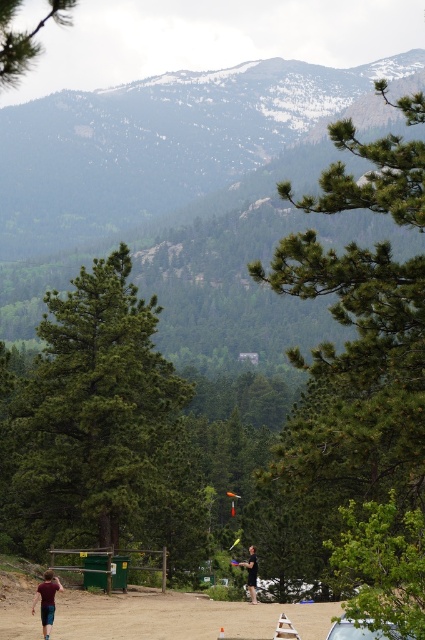
Describe the element at coordinates (99, 424) in the screenshot. This screenshot has width=425, height=640. I see `green rough bark tree at center` at that location.

Is the position of green rough bark tree at center more distant than that of metallic silver car at lower right?

Yes, green rough bark tree at center is behind metallic silver car at lower right.

Who is more forward, (68, 445) or (363, 632)?

Point (363, 632) is more forward.

I want to click on green rough bark tree at center, so click(99, 424).

Is green leafy tree at upper left bigger than maroon t-shirt at lower left?

Correct, green leafy tree at upper left is larger in size than maroon t-shirt at lower left.

Looking at this image, does green leafy tree at upper left appear under maroon t-shirt at lower left?

Actually, green leafy tree at upper left is above maroon t-shirt at lower left.

Between point (17, 1) and point (51, 611), which one is positioned in front?

Point (17, 1)

This screenshot has height=640, width=425. What are the coordinates of `green leafy tree at upper left` in the screenshot? It's located at (25, 38).

In the scene shown: Can you confirm if green leafy tree at upper left is positioned below black fabric shirt at lower center?

No.

Between green leafy tree at upper left and black fabric shirt at lower center, which one has more height?

Standing taller between the two is black fabric shirt at lower center.

Who is more forward, (48, 12) or (254, 573)?

Point (48, 12)

Find the location of a particular element. The image size is (425, 640). green leafy tree at upper left is located at coordinates (25, 38).